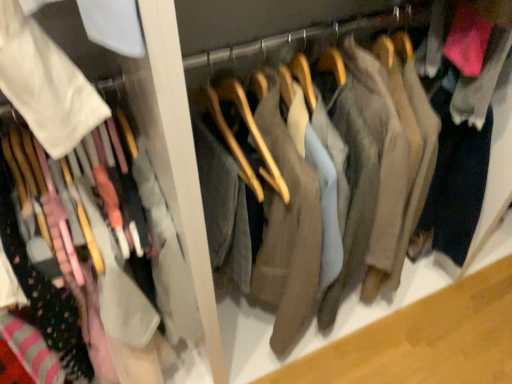
Image resolution: width=512 pixels, height=384 pixels. Describe the element at coordinates (45, 83) in the screenshot. I see `matte white shirt at left` at that location.

Identify the location of matte white shirt at left. (45, 83).

You are a GUI agent. You are given a task and a screenshot of the screen. Output one action in this format:
    pyautogui.click(x=<x>, y=<y>)
    Task: Click on the matte white shirt at left
    This screenshot has width=512, height=384.
    Given the screenshot: What is the action you would take?
    pyautogui.click(x=45, y=83)